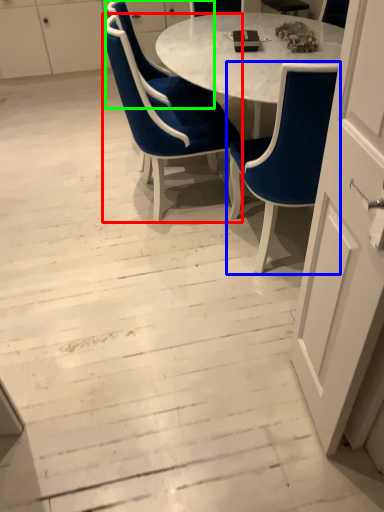
Question: Based on their relative distances, which object is nearer to chair (highlighted by a red box)? Choose from chair (highlighted by a blue box) and chair (highlighted by a green box).

Choices:
 (A) chair
 (B) chair

Answer: (B)